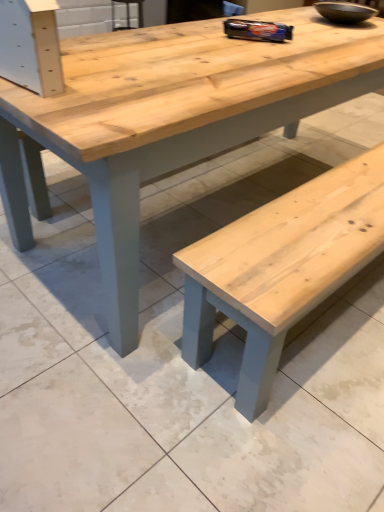
Find the location of a particular element. This screenshot has height=512, width=384. vacant space underneath natural wood table at center (from a real-world perspective) is located at coordinates (249, 188).